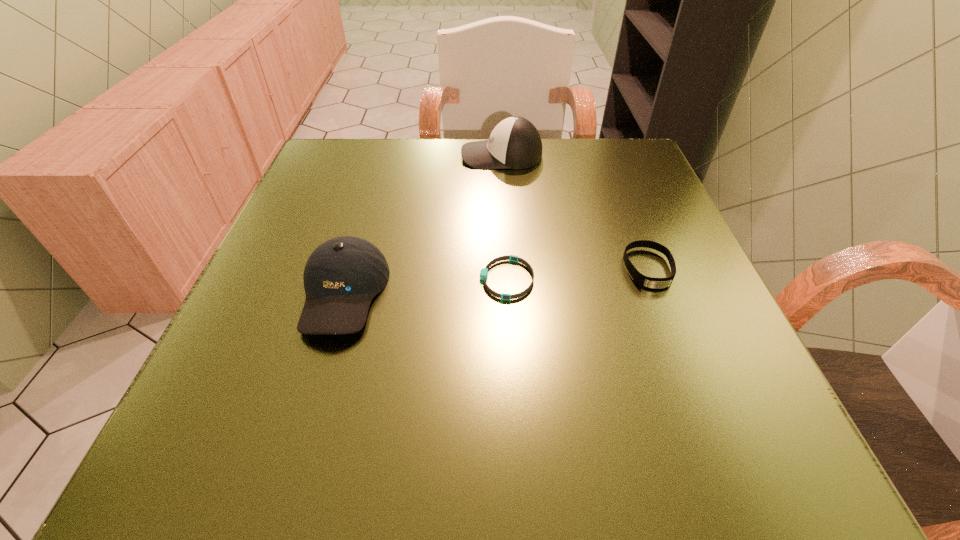
Image resolution: width=960 pixels, height=540 pixels. Identify the location of free space that satisfies the following two spatial constraints: 1. on the front panel of the cap; 2. on the front-facing side of the leftmost object. (511, 293).

The width and height of the screenshot is (960, 540). I want to click on free space that satisfies the following two spatial constraints: 1. on the front panel of the tallest object; 2. on the front-facing side of the third shortest object, so click(511, 293).

The width and height of the screenshot is (960, 540). What are the coordinates of `vacant region that satisfies the following two spatial constraints: 1. on the buckle of the shorter wristband; 2. on the front-facing side of the baseball cap` in the screenshot? It's located at (508, 293).

The image size is (960, 540). I want to click on free location that satisfies the following two spatial constraints: 1. on the display of the right wristband; 2. on the buckle of the shortest object, so click(x=652, y=279).